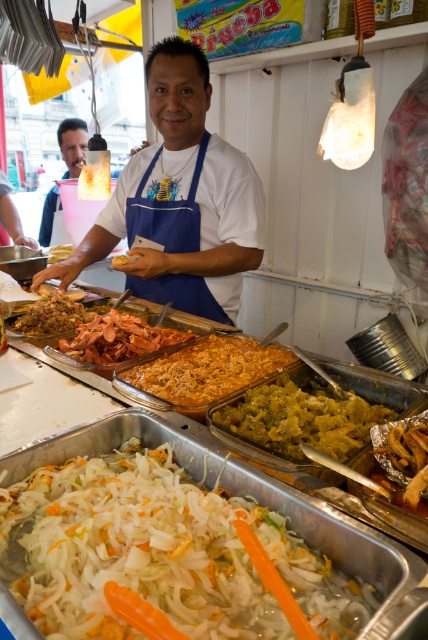
In the scene shown: You are a customer at the food stall. You want to choose between the golden brown crispy at center and the sliced pinkish meat at center. Which one is taller?

The golden brown crispy at center is much taller than the sliced pinkish meat at center.

You are a customer at the food stall and want to grab the white translucent plastic tray at center. However, there is the white matte apron at center in the way. Can you reach the tray without moving the apron?

The white matte apron at center is located above the white translucent plastic tray at center, so you can reach the tray by moving your hand underneath the apron.

You are a customer at the food stall and want to grab the white translucent plastic tray at center. However, you notice the white matte apron at center is in the way. Can you reach the tray without moving the apron?

The white matte apron at center is smaller than the white translucent plastic tray at center, so it is possible to reach around or over the apron to grab the tray without moving it.